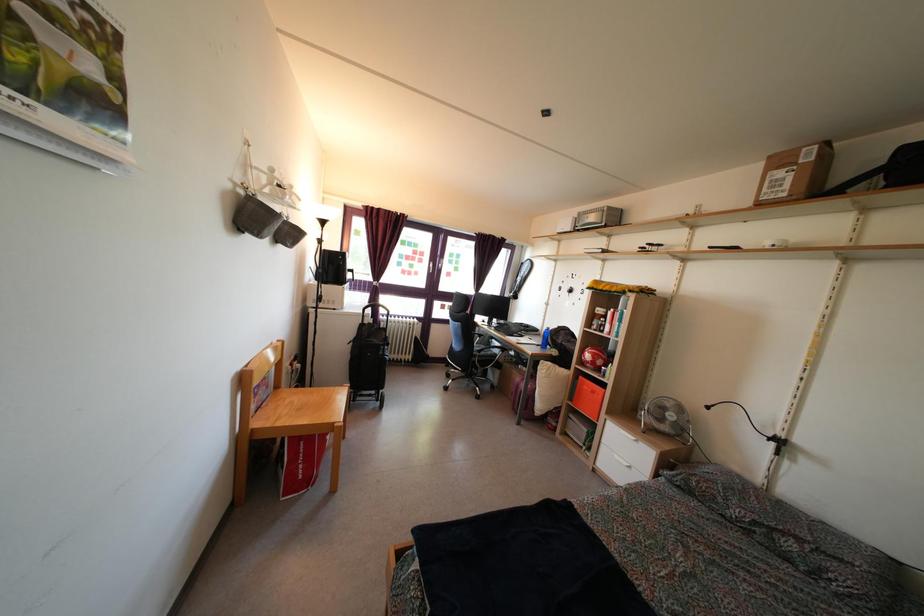
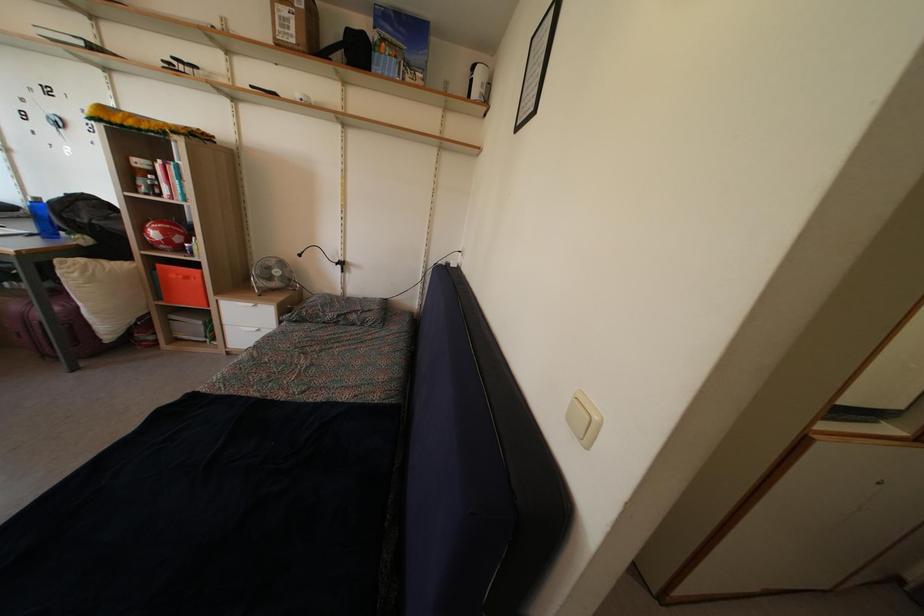
Where in the second image is the point corresponding to the point at 760,488 from the first image?

(342, 301)